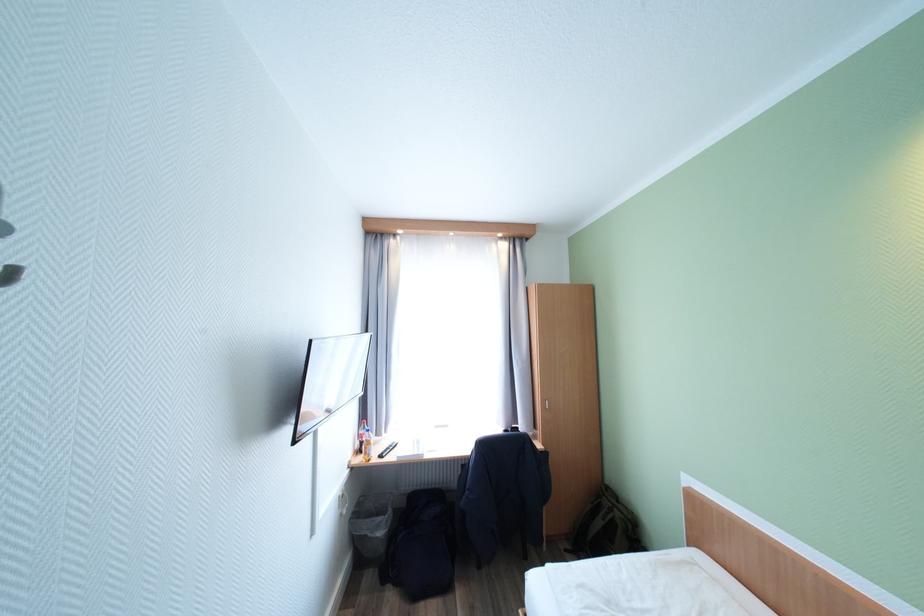
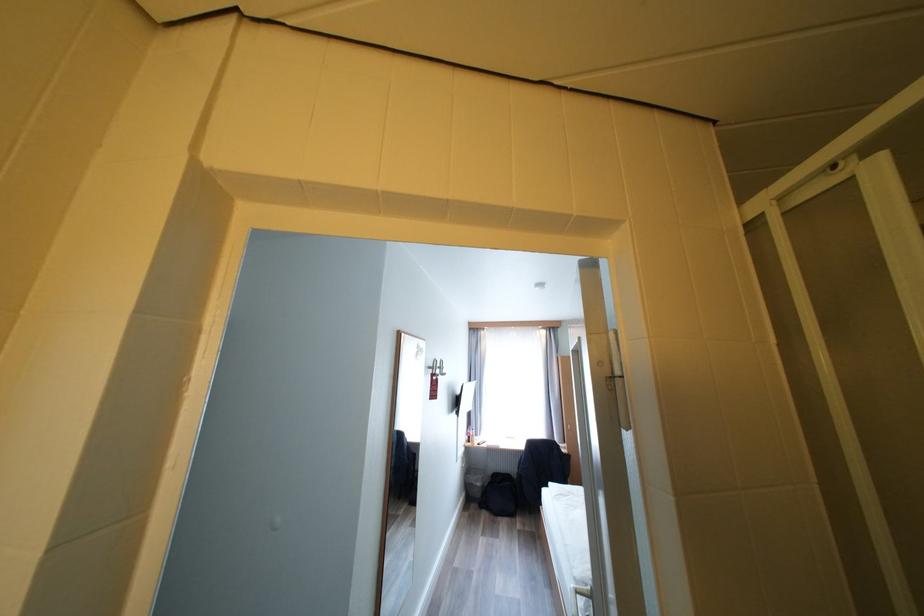
Question: I am providing you with two images of the same scene from different viewpoints. Please identify which objects are invisible in image2.

Choices:
 (A) red door tag
 (B) pink coffee mug
 (C) chair sitting surface
 (D) silver coat hook

Answer: (C)